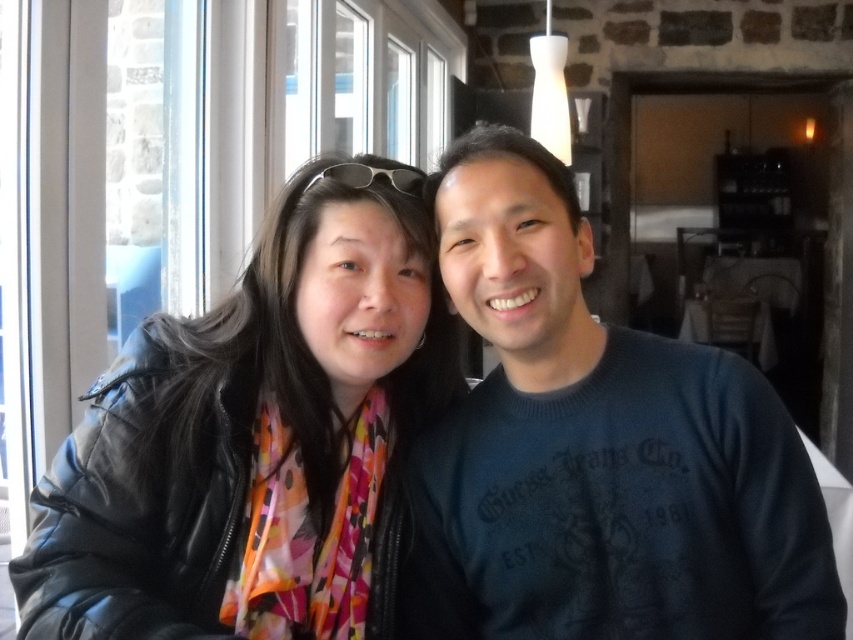
Question: Which of the following is the closest to the observer?

Choices:
 (A) (780, 422)
 (B) (125, 502)

Answer: (A)

Question: Which object is positioned farthest from the matte black jacket at center?

Choices:
 (A) dark blue sweater at center
 (B) sunglasses at center

Answer: (B)

Question: Is dark blue sweater at center positioned at the back of sunglasses at center?

Choices:
 (A) yes
 (B) no

Answer: (B)

Question: Which point is farther from the camera taking this photo?

Choices:
 (A) (519, 532)
 (B) (344, 179)

Answer: (B)

Question: Can you confirm if matte black jacket at center is positioned to the left of sunglasses at center?

Choices:
 (A) no
 (B) yes

Answer: (B)

Question: Does dark blue sweater at center appear on the right side of sunglasses at center?

Choices:
 (A) no
 (B) yes

Answer: (B)